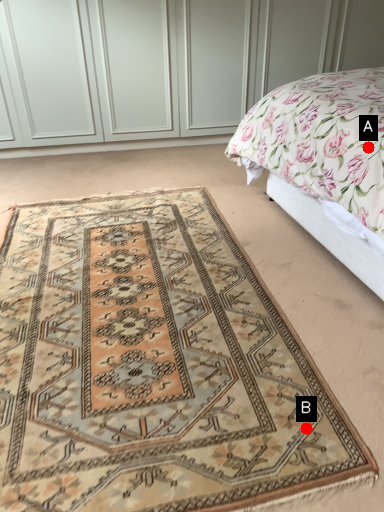
Question: Two points are circled on the image, labeled by A and B beside each circle. Which point is farther from the camera taking this photo?

Choices:
 (A) A is further
 (B) B is further

Answer: (A)